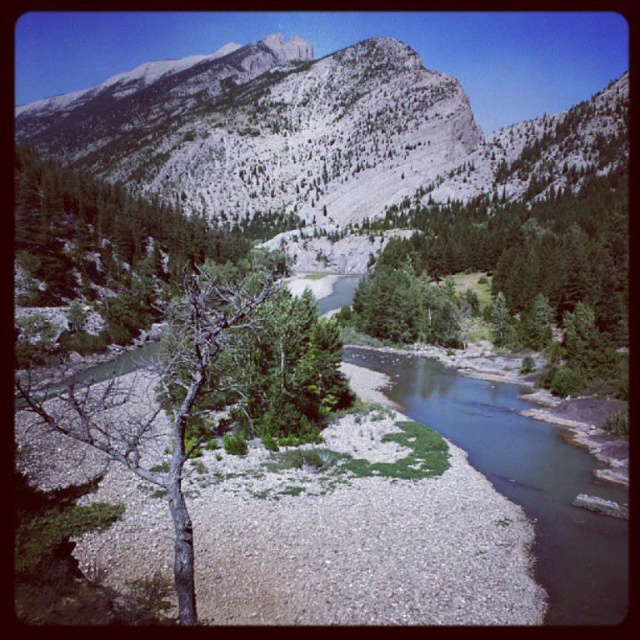
You are a hiker planning to cross the smooth gravel creek at center and then reach the gray rocky mountain at upper center. Based on the scene, which path would require more horizontal space to traverse? Explain your reasoning.

The gray rocky mountain at upper center requires more horizontal space to traverse because its width surpasses that of the smooth gravel creek at center, as indicated by the description.

You are planning to hike to the gray rocky mountain at upper center and the smooth gravel creek at center. Which of these two landmarks is bigger in size?

The gray rocky mountain at upper center is larger in size than the smooth gravel creek at center.

You are a hiker planning to take a photo of the gray rocky mountain at upper center. Based on the coordinates provided, where should you position yourself to capture the mountain in the center of your photo?

To capture the gray rocky mountain at upper center in the center of your photo, position yourself directly in line with its coordinates at point 0.208 on the horizontal axis and 0.466 on the vertical axis.